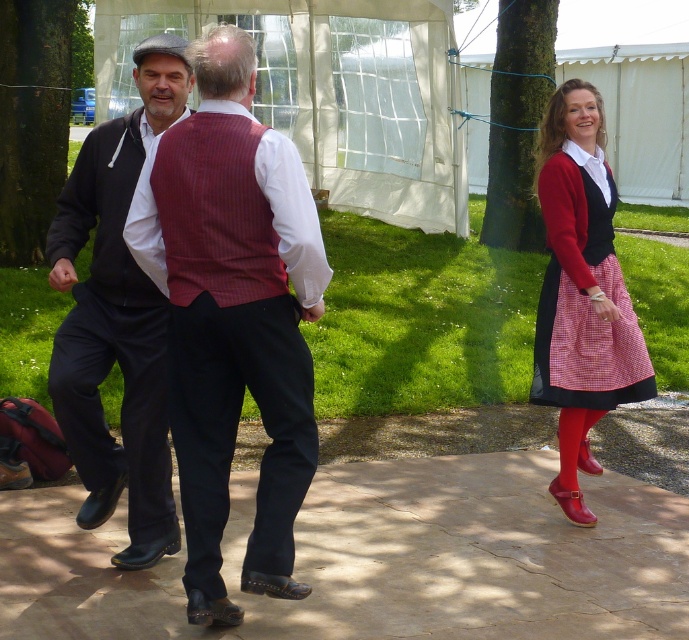
Question: Which point is closer to the camera taking this photo?

Choices:
 (A) (81, 378)
 (B) (68, 385)
 (C) (608, 294)
 (D) (245, 227)

Answer: (D)

Question: Which point is farther to the camera?

Choices:
 (A) (218, 515)
 (B) (163, 401)
 (C) (176, 109)

Answer: (B)

Question: Is black smooth pants at left to the right of red checkered vest at center from the viewer's perspective?

Choices:
 (A) yes
 (B) no

Answer: (B)

Question: Which object is positioned closest to the matte red vest at center?

Choices:
 (A) red checkered vest at center
 (B) black smooth pants at center

Answer: (B)

Question: Is matte red vest at center above black smooth pants at center?

Choices:
 (A) no
 (B) yes

Answer: (B)

Question: Does matte red vest at center appear on the right side of black smooth pants at left?

Choices:
 (A) yes
 (B) no

Answer: (A)